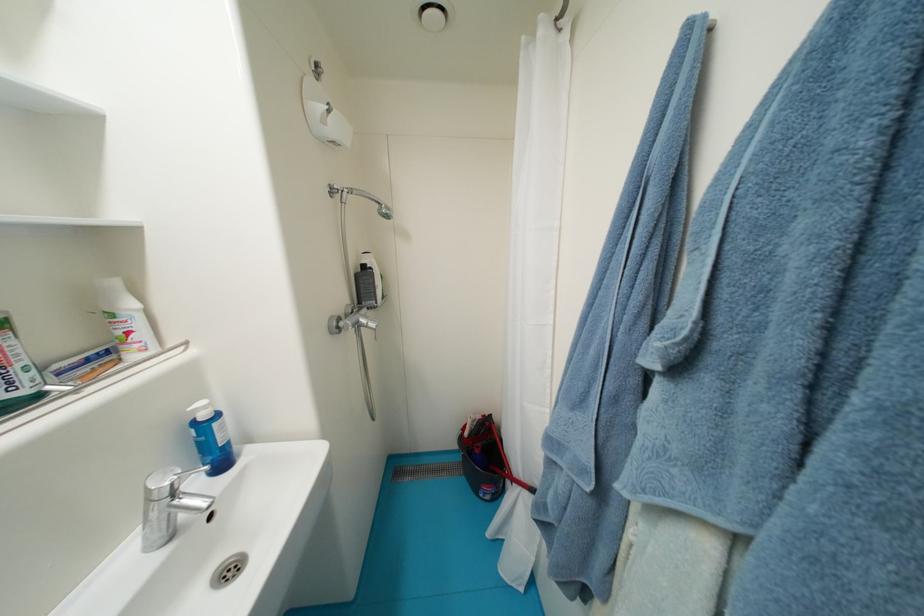
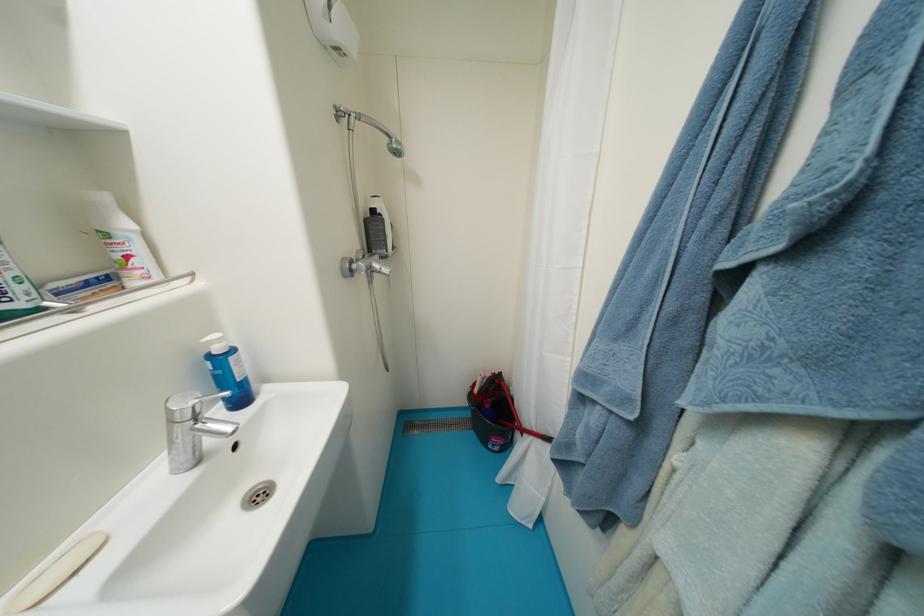
Question: How did the camera likely rotate?

Choices:
 (A) Left
 (B) Right
 (C) Up
 (D) Down

Answer: (D)